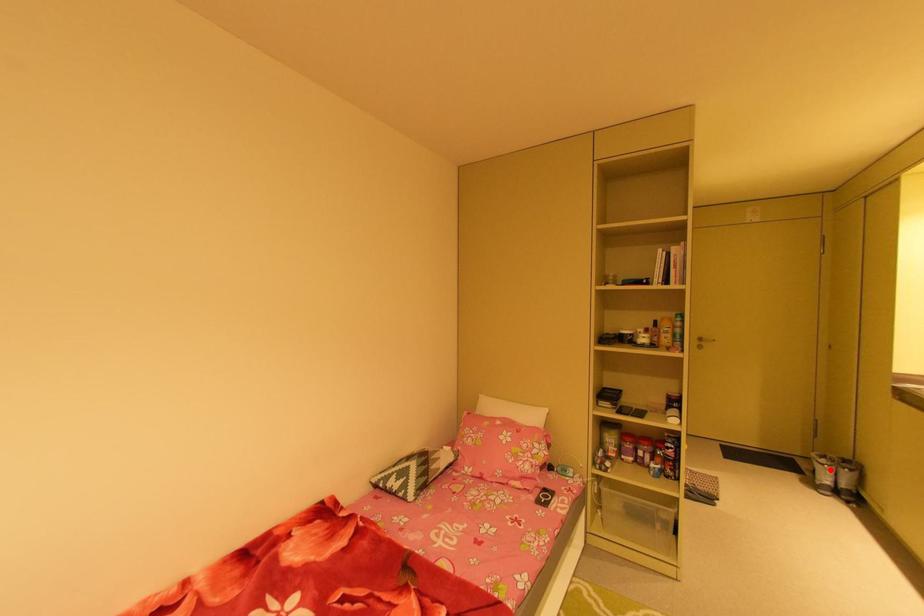
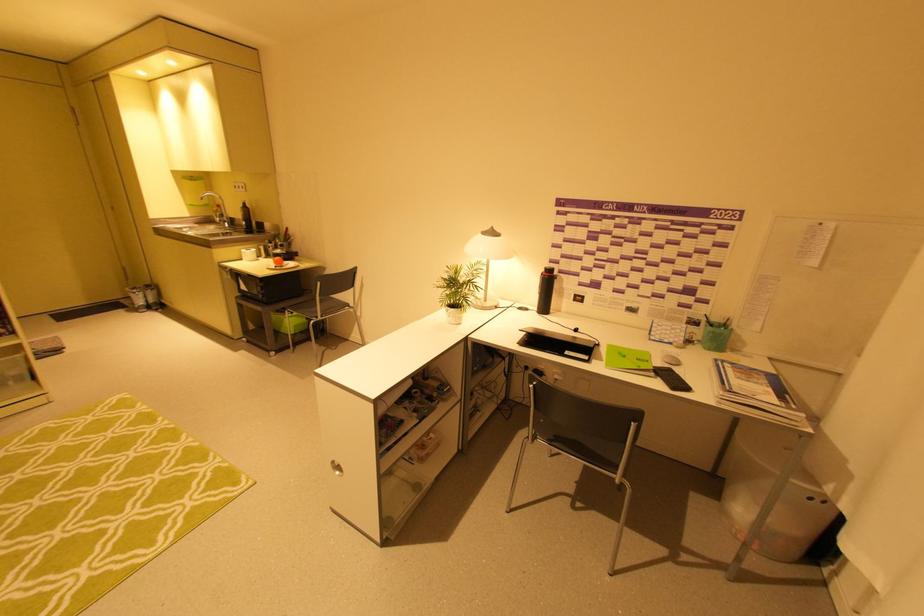
Question: I am providing you with two images of the same scene from different viewpoints. Given a red point in image1, look at the same physical point in image2. Is it:

Choices:
 (A) Closer to the viewpoint
 (B) Farther from the viewpoint

Answer: (B)